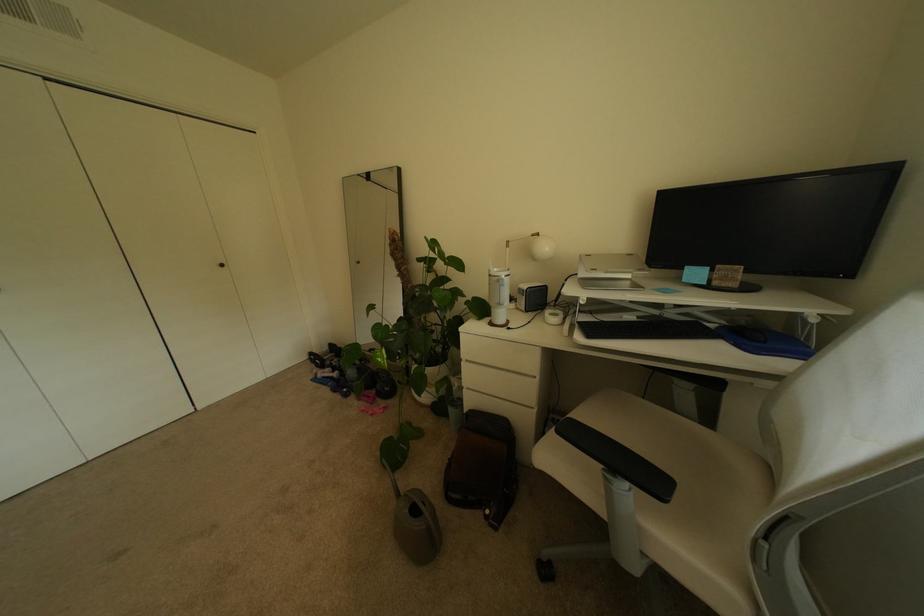
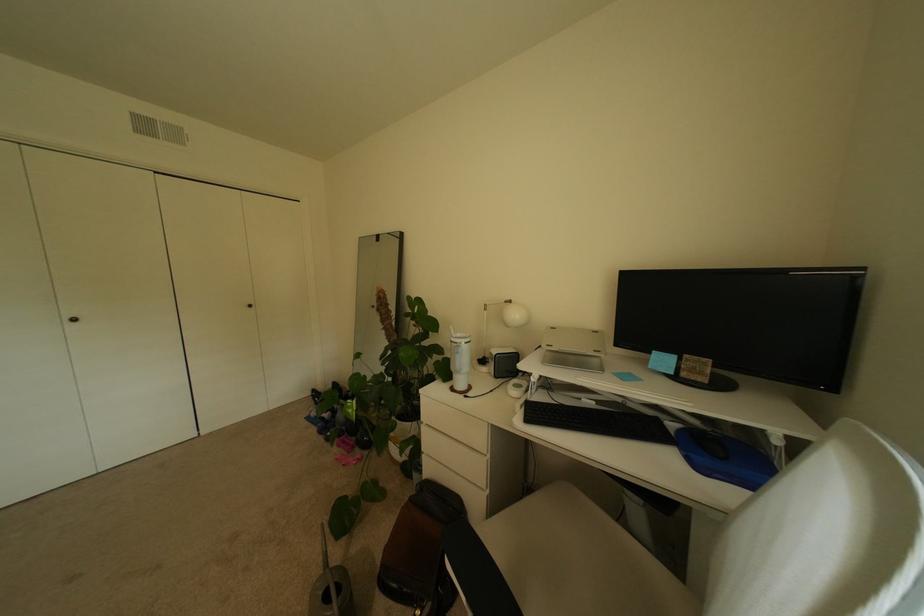
Question: What movement of the cameraman would produce the second image?

Choices:
 (A) Left
 (B) Right
 (C) Forward
 (D) Backward

Answer: (B)